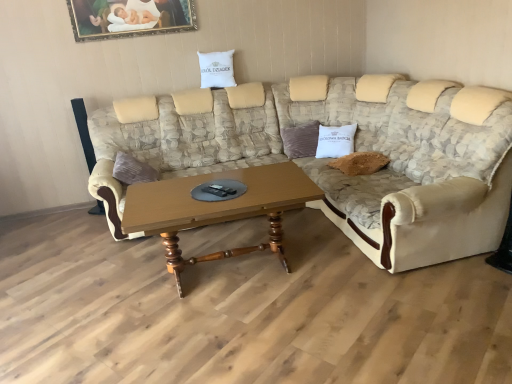
Image resolution: width=512 pixels, height=384 pixels. What are the coordinates of `space that is in front of wooden polished coffee table at center` in the screenshot? It's located at (244, 337).